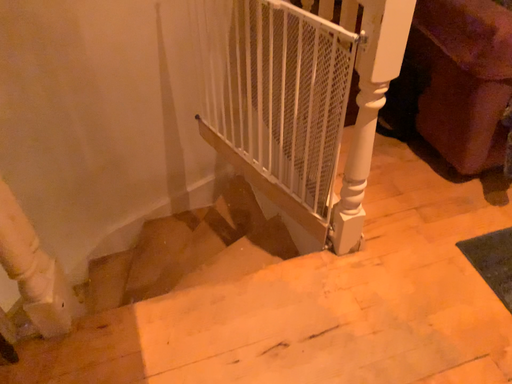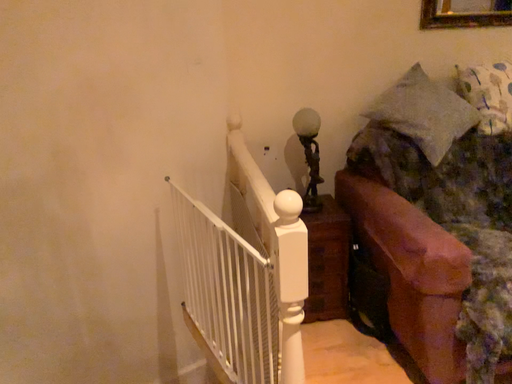
Question: Which way did the camera rotate in the video?

Choices:
 (A) rotated right
 (B) rotated left

Answer: (B)